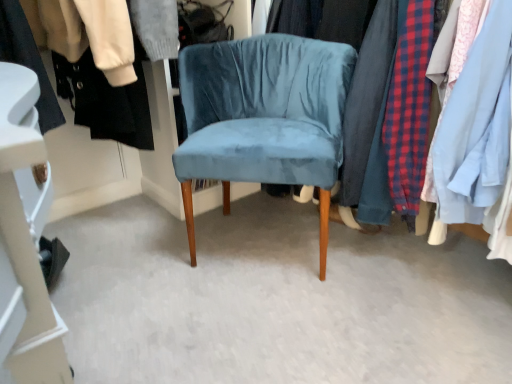
Question: Are velvet fabric clothes at center, the second closet from the left, and black fabric shoe at lower left, positioned as the 2th closet in right-to-left order, far apart?

Choices:
 (A) yes
 (B) no

Answer: (B)

Question: Can you confirm if velvet fabric clothes at center, the second closet from the left, is taller than black fabric shoe at lower left, positioned as the 2th closet in right-to-left order?

Choices:
 (A) no
 (B) yes

Answer: (B)

Question: Is black fabric shoe at lower left, positioned as the 2th closet in right-to-left order, completely or partially inside velvet fabric clothes at center, positioned as the first closet in right-to-left order?

Choices:
 (A) no
 (B) yes

Answer: (A)

Question: Can you confirm if velvet fabric clothes at center, the second closet from the left, is thinner than black fabric shoe at lower left, the first closet positioned from the left?

Choices:
 (A) yes
 (B) no

Answer: (B)

Question: Is velvet fabric clothes at center, the second closet from the left, placed right next to black fabric shoe at lower left, positioned as the 2th closet in right-to-left order?

Choices:
 (A) yes
 (B) no

Answer: (B)

Question: Can you confirm if velvet fabric clothes at center, positioned as the first closet in right-to-left order, is shorter than black fabric shoe at lower left, positioned as the 2th closet in right-to-left order?

Choices:
 (A) no
 (B) yes

Answer: (A)

Question: Is velvet blue chair at center in contact with velvet fabric clothes at center, the second closet from the left?

Choices:
 (A) no
 (B) yes

Answer: (A)

Question: Is velvet blue chair at center far from velvet fabric clothes at center, the second closet from the left?

Choices:
 (A) yes
 (B) no

Answer: (B)

Question: Is velvet blue chair at center wider than velvet fabric clothes at center, the second closet from the left?

Choices:
 (A) no
 (B) yes

Answer: (A)

Question: Is velvet blue chair at center at the left side of velvet fabric clothes at center, the second closet from the left?

Choices:
 (A) yes
 (B) no

Answer: (A)

Question: From the image's perspective, does velvet blue chair at center appear lower than velvet fabric clothes at center, positioned as the first closet in right-to-left order?

Choices:
 (A) yes
 (B) no

Answer: (A)

Question: Considering the relative sizes of velvet blue chair at center and velvet fabric clothes at center, positioned as the first closet in right-to-left order, in the image provided, is velvet blue chair at center smaller than velvet fabric clothes at center, positioned as the first closet in right-to-left order,?

Choices:
 (A) no
 (B) yes

Answer: (B)

Question: Is black fabric shoe at lower left, the first closet positioned from the left, placed right next to velvet fabric clothes at center, the second closet from the left?

Choices:
 (A) no
 (B) yes

Answer: (A)